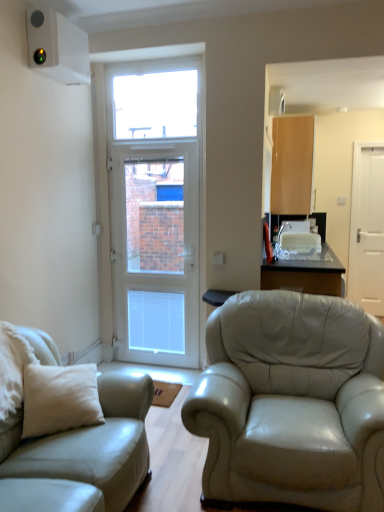
Question: Considering the positions of transparent glass table at center and light brown wood cabinet at upper right in the image, is transparent glass table at center wider or thinner than light brown wood cabinet at upper right?

Choices:
 (A) wide
 (B) thin

Answer: (A)

Question: Does point (276, 274) appear closer or farther from the camera than point (276, 143)?

Choices:
 (A) closer
 (B) farther

Answer: (A)

Question: Which object is the farthest from the transparent glass window at upper center?

Choices:
 (A) light brown wood cabinet at upper right
 (B) white matte door at right, the first door positioned from the right
 (C) transparent glass table at center
 (D) light beige leather couch at left
 (E) white glossy door at center, arranged as the first door when viewed from the front

Answer: (D)

Question: Which object is the closest to the white glossy door at center, the first door in the left-to-right sequence?

Choices:
 (A) transparent glass window at upper center
 (B) light beige leather couch at left
 (C) light brown wood cabinet at upper right
 (D) white matte door at right, which is the second door in left-to-right order
 (E) transparent glass table at center

Answer: (A)